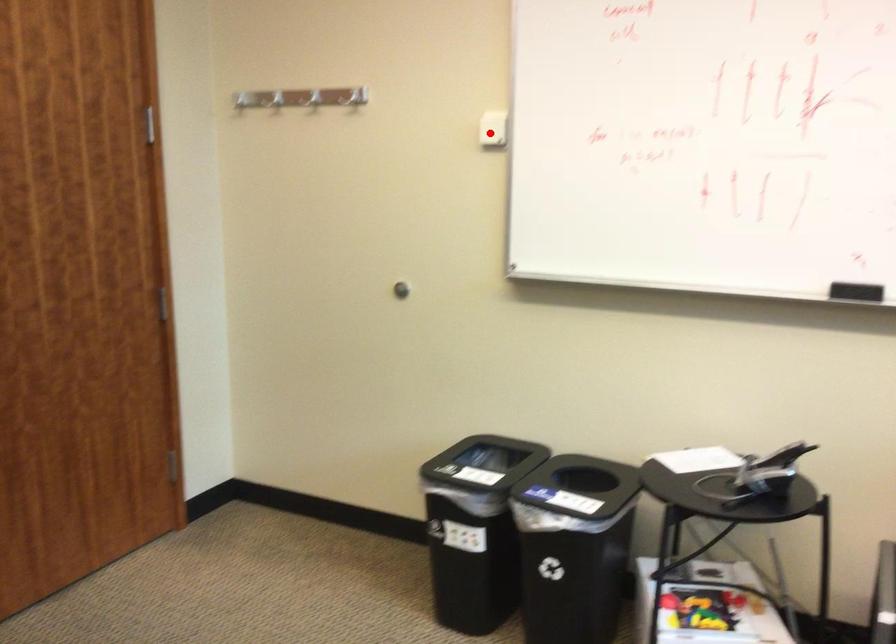
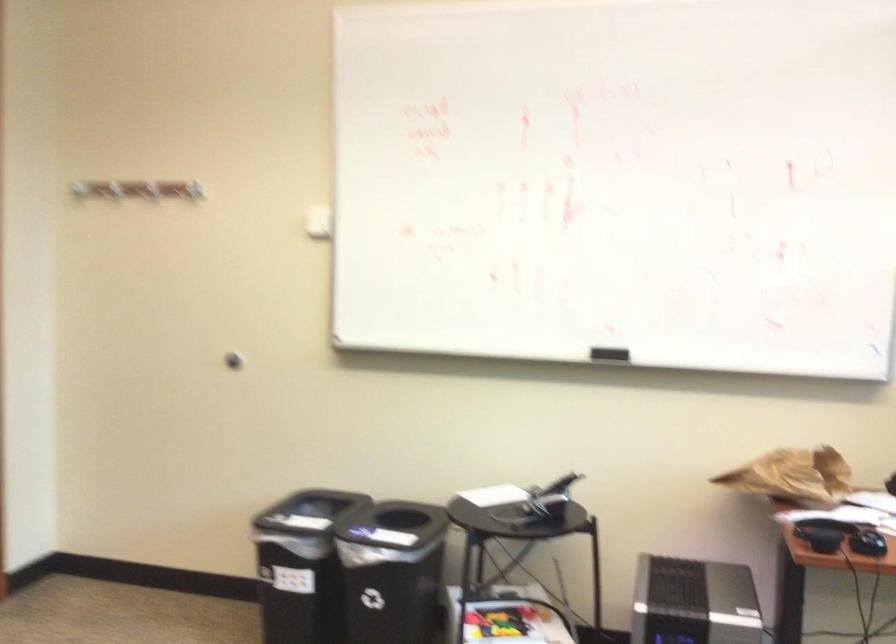
Question: I am providing you with two images of the same scene from different viewpoints. Image1 has a red point marked. In image2, the corresponding 3D location appears at what relative position? Reply with the corresponding letter.

Choices:
 (A) Closer
 (B) Farther

Answer: (B)